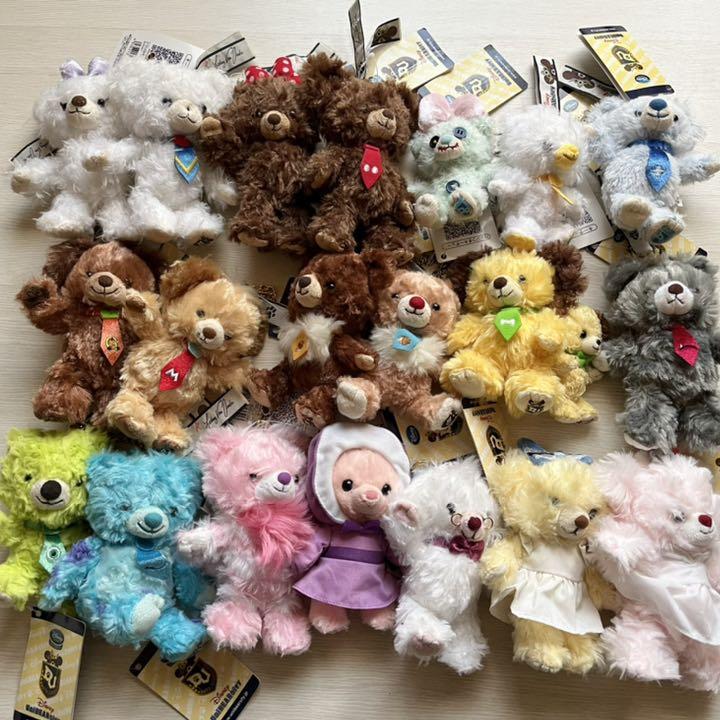
Image resolution: width=720 pixels, height=720 pixels. Identify the location of brown stuffed bears. (266, 171), (361, 198), (346, 287), (103, 319).